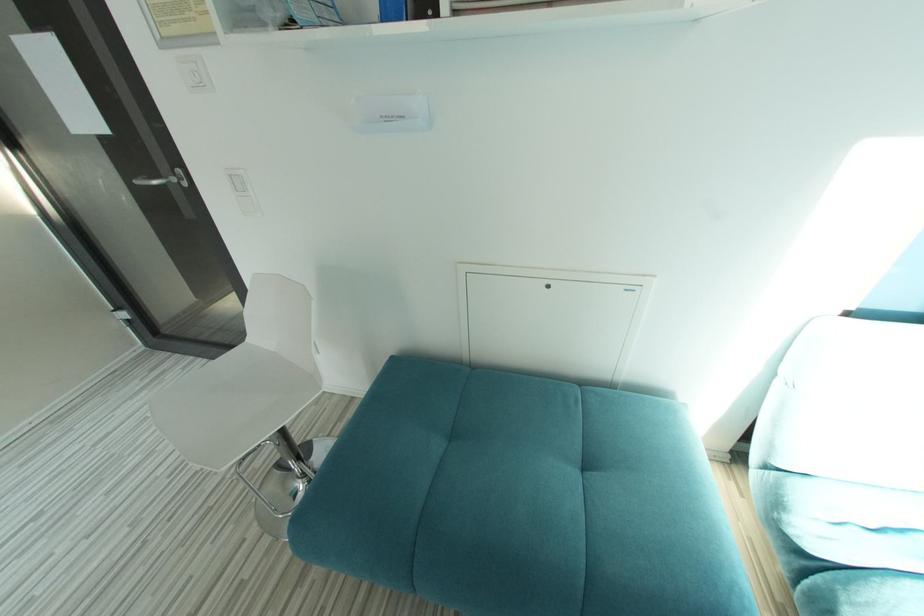
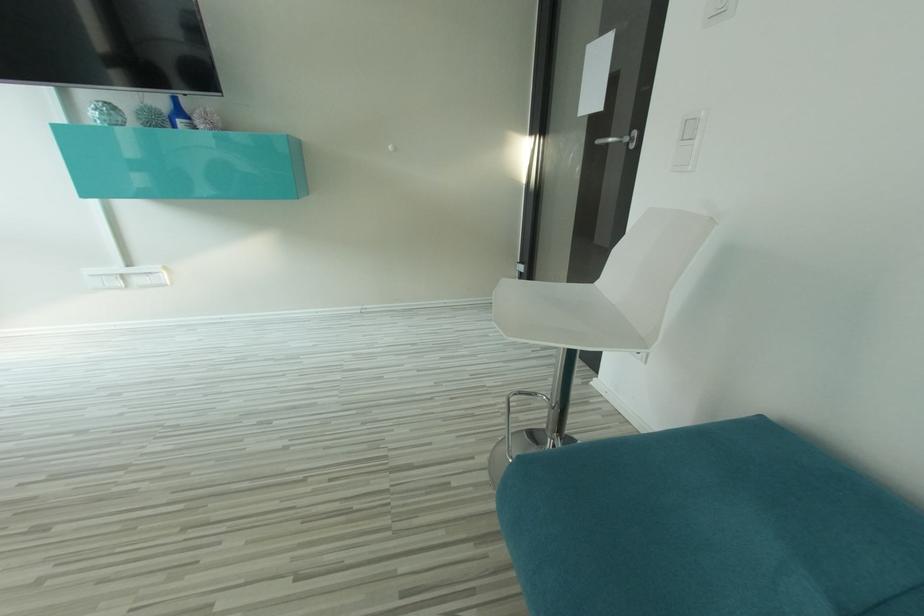
Question: How did the camera likely rotate?

Choices:
 (A) Left
 (B) Right
 (C) Up
 (D) Down

Answer: (A)